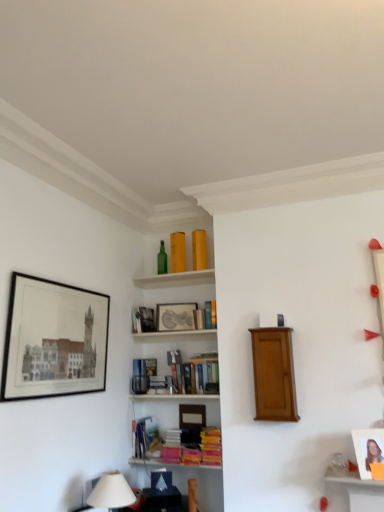
The height and width of the screenshot is (512, 384). I want to click on unoccupied space behind matte black picture frame at center, the 3th picture frame from the bottom, so click(171, 336).